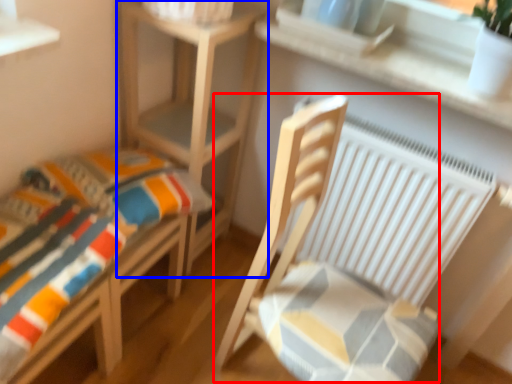
Question: Which object appears farthest to the camera in this image, rocking chair (highlighted by a red box) or table (highlighted by a blue box)?

Choices:
 (A) rocking chair
 (B) table

Answer: (B)